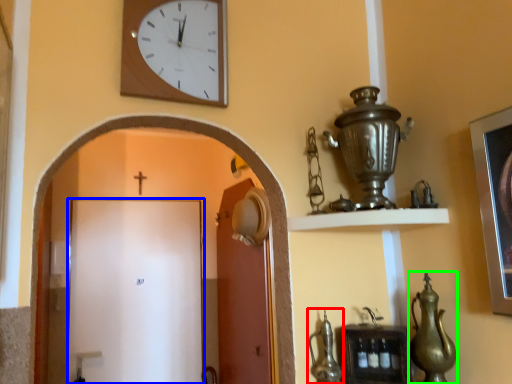
Question: Which is farther away from tea pot (highlighted by a red box)? door (highlighted by a blue box) or tea pot (highlighted by a green box)?

Choices:
 (A) door
 (B) tea pot

Answer: (A)